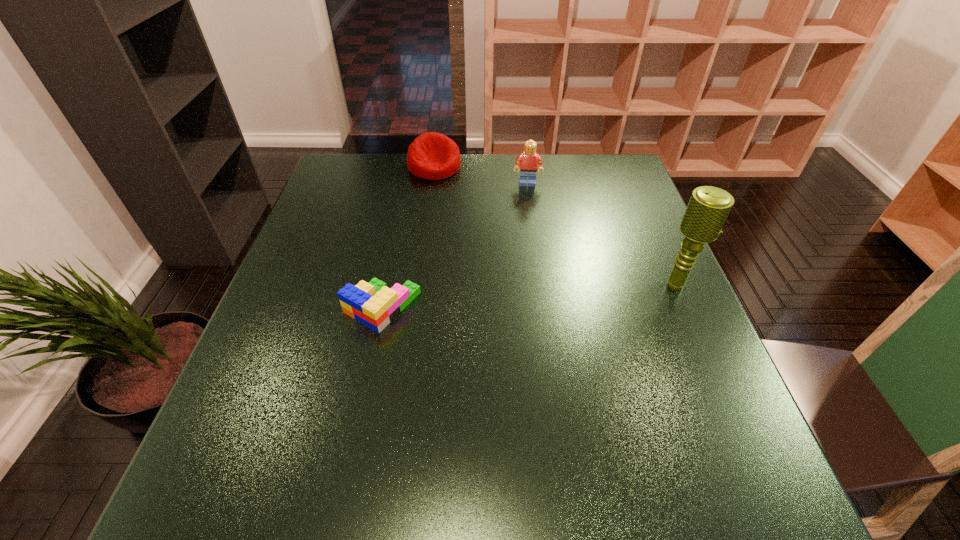
Where is `free space between the second shortest object and the tallest object`? free space between the second shortest object and the tallest object is located at coordinates (555, 226).

Where is `vacant area that lies between the shorter Lego and the right Lego`? The image size is (960, 540). vacant area that lies between the shorter Lego and the right Lego is located at coordinates (455, 245).

The width and height of the screenshot is (960, 540). Identify the location of vacant area that lies between the third object from left to right and the second shortest object. (481, 175).

This screenshot has width=960, height=540. Identify the location of vacant area between the third object from left to right and the third tallest object. (481, 175).

This screenshot has height=540, width=960. In order to click on vacant area between the tallest object and the second tallest object in this screenshot , I will do `click(602, 234)`.

Locate which object ranks in proximity to the rightmost object. Please provide its 2D coordinates. Your answer should be formatted as a tuple, i.e. [(x, y)], where the tuple contains the x and y coordinates of a point satisfying the conditions above.

[(529, 160)]

Locate an element on the screen. This screenshot has height=540, width=960. the closest object to the shorter Lego is located at coordinates (432, 156).

In order to click on vacant point that satisfies the following two spatial constraints: 1. on the front side of the rightmost object; 2. on the left side of the beanbag in this screenshot , I will do `click(419, 284)`.

This screenshot has height=540, width=960. In order to click on free space that satisfies the following two spatial constraints: 1. on the front side of the tallest object; 2. on the right side of the second tallest object in this screenshot , I will do `click(541, 284)`.

Identify the location of vacant position in the image that satisfies the following two spatial constraints: 1. on the back side of the beanbag; 2. on the right side of the shorter Lego. (411, 167).